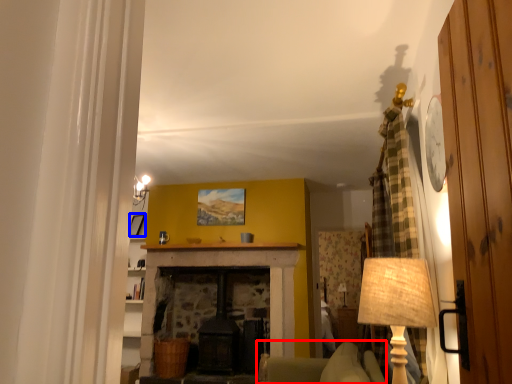
Question: Which object is further to the camera taking this photo, armchair (highlighted by a red box) or picture frame (highlighted by a blue box)?

Choices:
 (A) armchair
 (B) picture frame

Answer: (B)